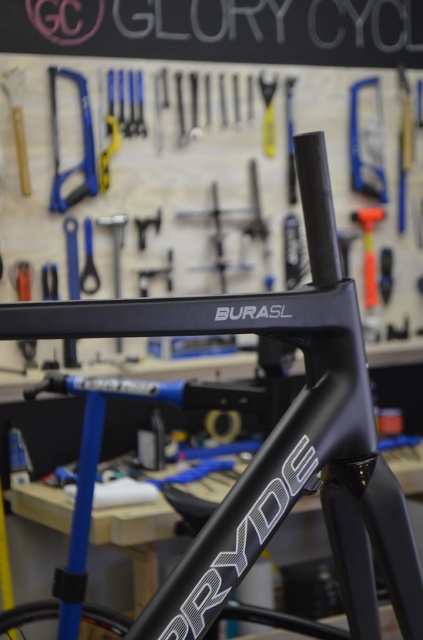
Question: Is matte black tools at upper center to the right of brushed metal hammer at upper center from the viewer's perspective?

Choices:
 (A) no
 (B) yes

Answer: (A)

Question: Which object is positioned closest to the black glossy frame at center?

Choices:
 (A) brushed metal saw at upper left
 (B) orange plastic hammer at upper right

Answer: (A)

Question: Which of the following is the farthest from the observer?

Choices:
 (A) blue plastic saw at upper left
 (B) brushed metal hammer at upper center

Answer: (B)

Question: Observing the image, what is the correct spatial positioning of black glossy frame at center in reference to orange plastic hammer at upper right?

Choices:
 (A) above
 (B) below

Answer: (B)

Question: Is black glossy frame at center wider than brushed metal saw at upper left?

Choices:
 (A) yes
 (B) no

Answer: (A)

Question: Which of these objects is positioned farthest from the matte black tools at upper center?

Choices:
 (A) black glossy frame at center
 (B) brushed metal saw at upper left
 (C) metallic blue screwdriver at upper center
 (D) brushed metal hammer at upper center

Answer: (A)